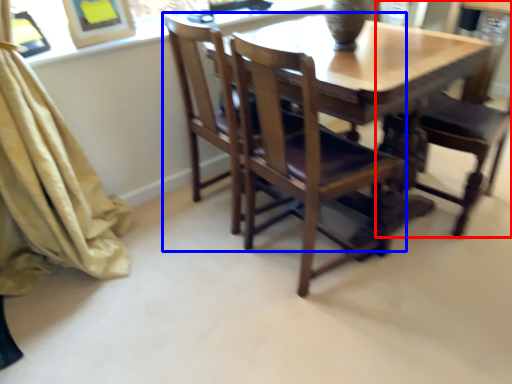
Question: Which point is further to the camera, chair (highlighted by a red box) or chair (highlighted by a blue box)?

Choices:
 (A) chair
 (B) chair

Answer: (A)